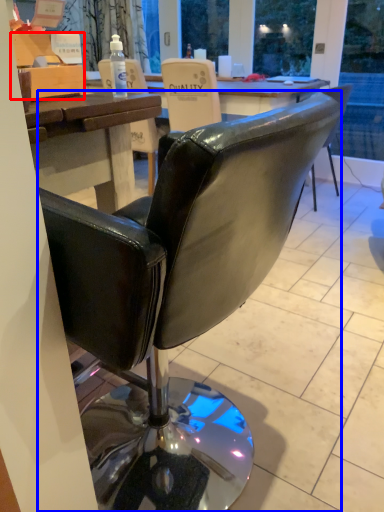
Question: Among these objects, which one is nearest to the camera, box (highlighted by a red box) or chair (highlighted by a blue box)?

Choices:
 (A) box
 (B) chair

Answer: (B)